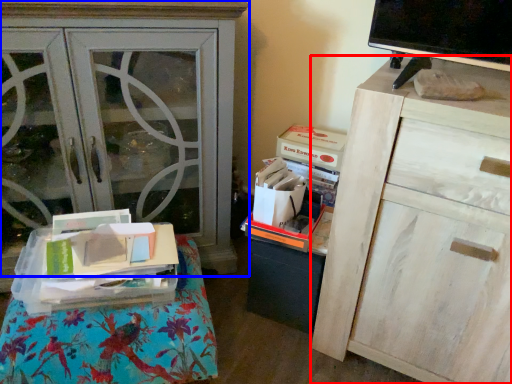
Question: Which of the following is the closest to the observer, chest of drawers (highlighted by a red box) or cabinetry (highlighted by a blue box)?

Choices:
 (A) chest of drawers
 (B) cabinetry

Answer: (A)